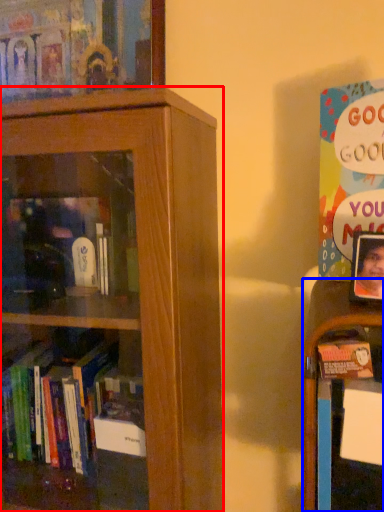
Question: Which object appears closest to the camera in this image, bookcase (highlighted by a red box) or shelf (highlighted by a blue box)?

Choices:
 (A) bookcase
 (B) shelf

Answer: (A)